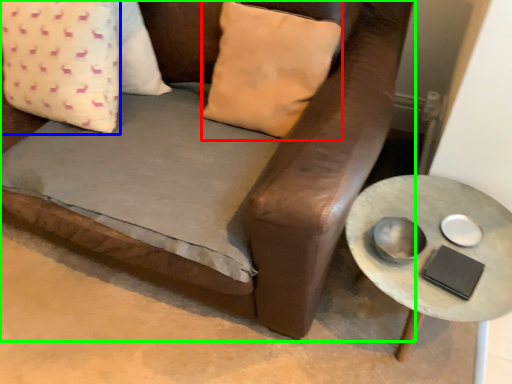
Question: Which object is positioned closest to pillow (highlighted by a red box)? Select from pillow (highlighted by a blue box) and studio couch (highlighted by a green box).

Choices:
 (A) pillow
 (B) studio couch

Answer: (B)